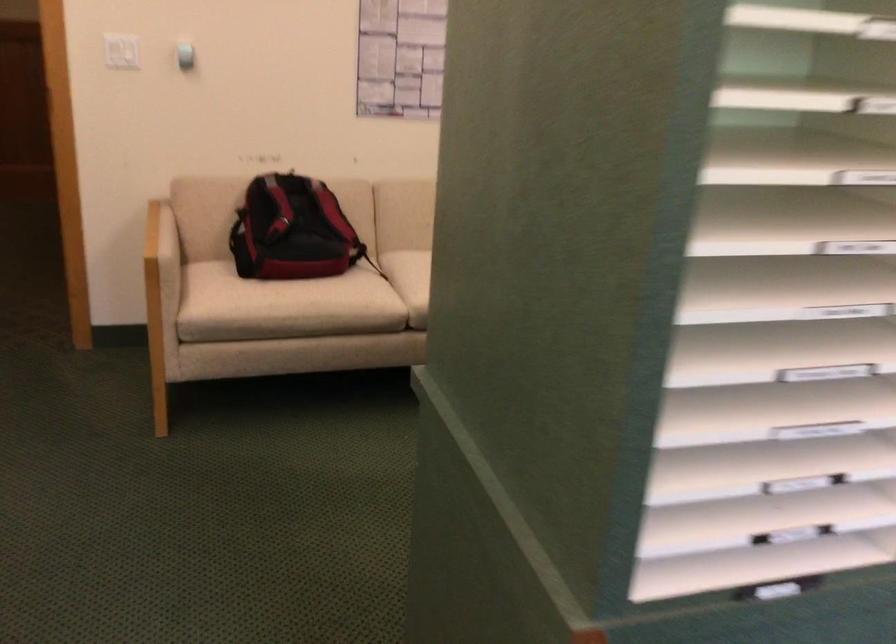
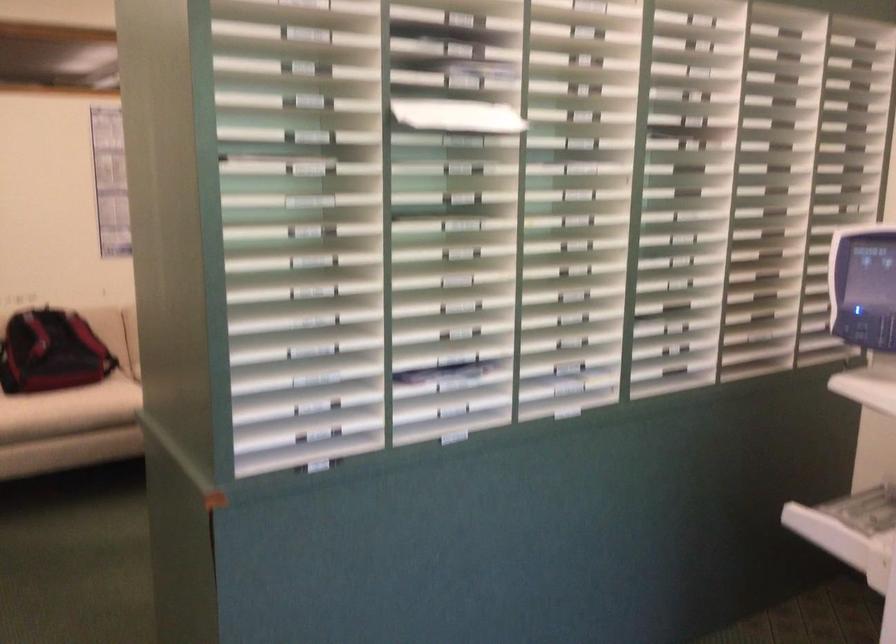
Question: In a continuous first-person perspective shot, in which direction is the camera moving?

Choices:
 (A) Left
 (B) Right
 (C) Forward
 (D) Backward

Answer: (D)